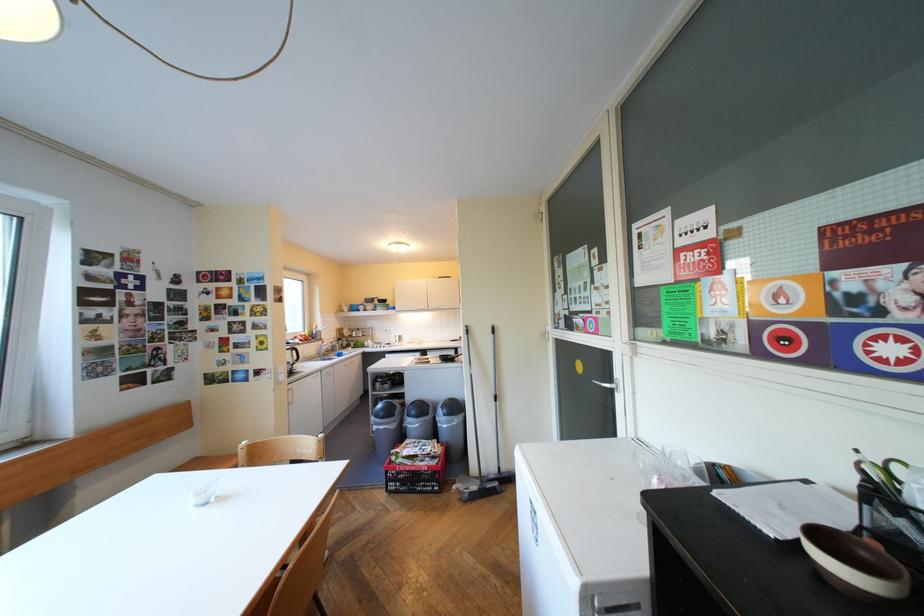
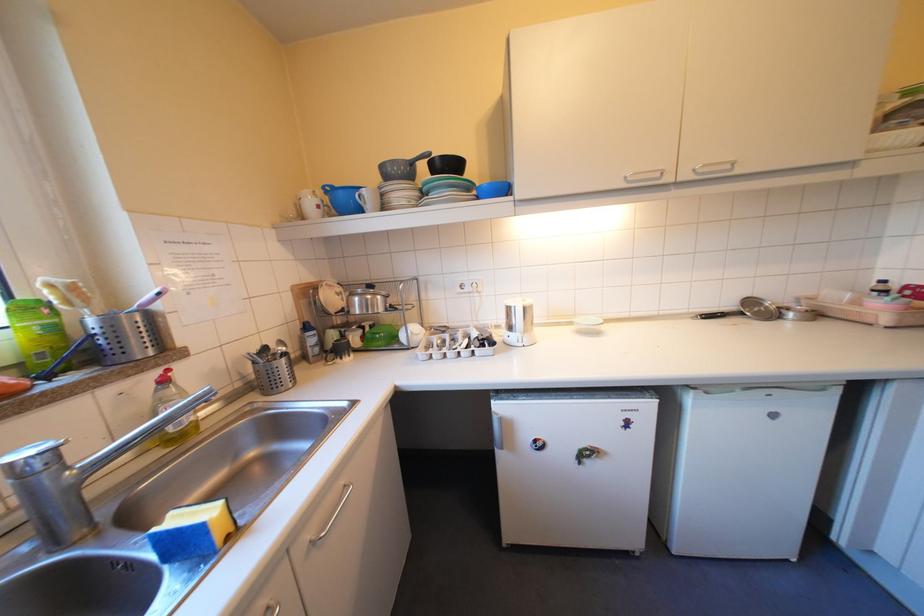
Locate, in the second image, the point that corresponds to the point at 359,342 in the first image.

(346, 334)